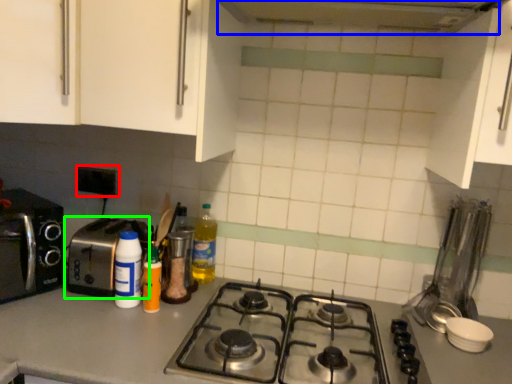
Question: Based on their relative distances, which object is nearer to electric outlet (highlighted by a red box)? Choose from exhaust hood (highlighted by a blue box) and toaster (highlighted by a green box).

Choices:
 (A) exhaust hood
 (B) toaster

Answer: (B)